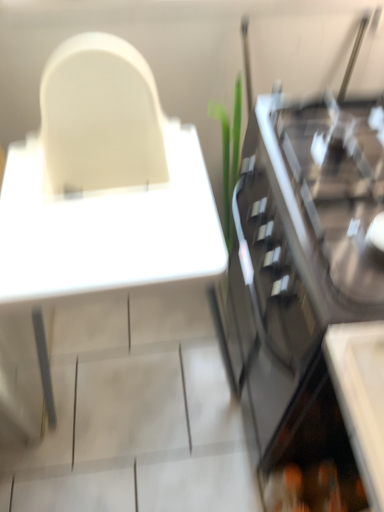
Question: Is white plastic table at upper left turned away from black glass cabinet at right?

Choices:
 (A) no
 (B) yes

Answer: (A)

Question: Does white plastic table at upper left have a lesser height compared to black glass cabinet at right?

Choices:
 (A) yes
 (B) no

Answer: (B)

Question: From a real-world perspective, does white plastic table at upper left stand above black glass cabinet at right?

Choices:
 (A) no
 (B) yes

Answer: (B)

Question: Is white plastic table at upper left outside black glass cabinet at right?

Choices:
 (A) yes
 (B) no

Answer: (A)

Question: Are white plastic table at upper left and black glass cabinet at right making contact?

Choices:
 (A) yes
 (B) no

Answer: (B)

Question: From a real-world perspective, does white plastic table at upper left sit lower than black glass cabinet at right?

Choices:
 (A) yes
 (B) no

Answer: (B)

Question: Is black glass cabinet at right smaller than white plastic table at upper left?

Choices:
 (A) no
 (B) yes

Answer: (B)

Question: Does black glass cabinet at right come behind white plastic table at upper left?

Choices:
 (A) yes
 (B) no

Answer: (A)

Question: Does black glass cabinet at right have a lesser height compared to white plastic table at upper left?

Choices:
 (A) yes
 (B) no

Answer: (A)

Question: Does black glass cabinet at right come in front of white plastic table at upper left?

Choices:
 (A) no
 (B) yes

Answer: (A)

Question: From the image's perspective, is black glass cabinet at right located beneath white plastic table at upper left?

Choices:
 (A) no
 (B) yes

Answer: (B)

Question: Could you tell me if black glass cabinet at right is facing white plastic table at upper left?

Choices:
 (A) yes
 (B) no

Answer: (A)

Question: From a real-world perspective, is white plastic table at upper left physically located above or below black glass cabinet at right?

Choices:
 (A) below
 (B) above

Answer: (B)